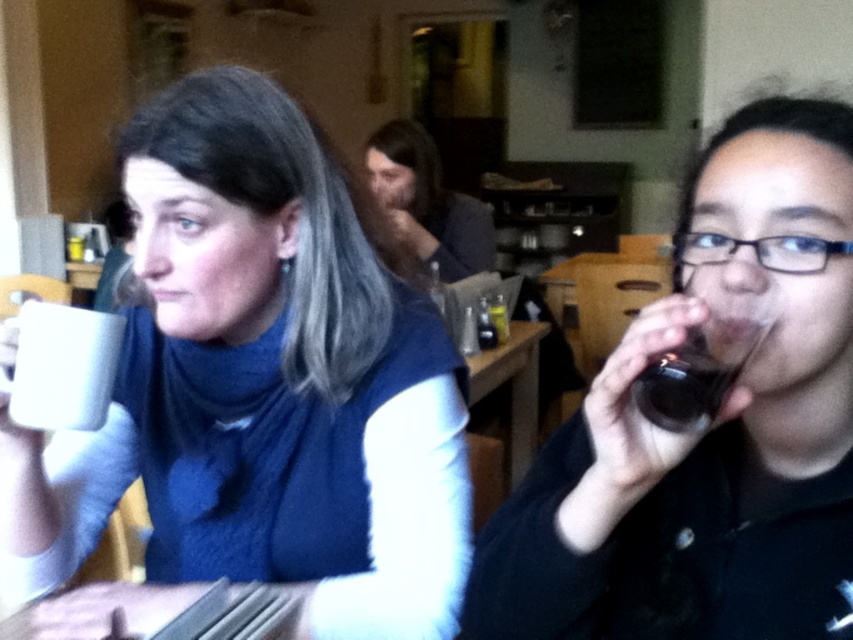
You are a barista at the cafe and need to place a new drink order for the customer. The order requires the dark brown liquid at right to be placed exactly 5 inches away from the matte black glass at right. Can you confirm if the current placement meets the requirement?

The matte black glass at right is 4.69 inches away from dark brown liquid at right, which is less than the required 5 inches. The current placement does not meet the requirement.